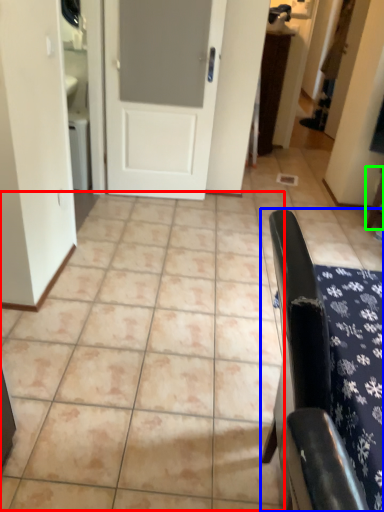
Question: Based on their relative distances, which object is farther from ceramic tile (highlighted by a red box)? Choose from furniture (highlighted by a blue box) and furniture (highlighted by a green box).

Choices:
 (A) furniture
 (B) furniture

Answer: (B)